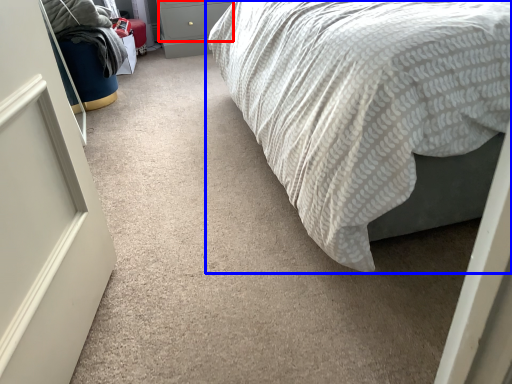
Question: Which object is closer to the camera taking this photo, drawer (highlighted by a red box) or bed (highlighted by a blue box)?

Choices:
 (A) drawer
 (B) bed

Answer: (B)